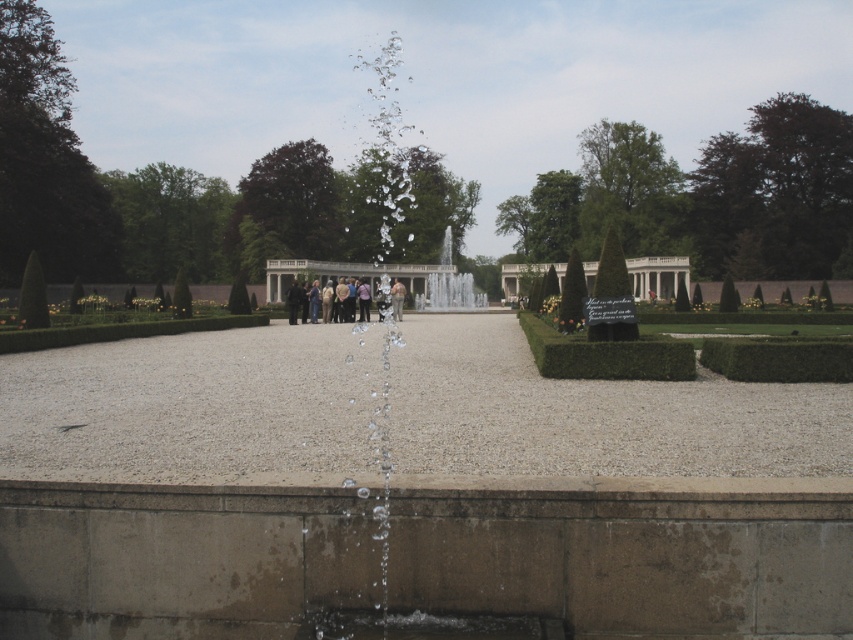
Question: Is gray gravel path at center closer to the viewer compared to green hedge at lower right?

Choices:
 (A) no
 (B) yes

Answer: (B)

Question: Which of the following is the closest to the observer?

Choices:
 (A) clear glass water at center
 (B) gray gravel path at center

Answer: (B)

Question: Where is gray gravel path at center located in relation to matte black people at center in the image?

Choices:
 (A) below
 (B) above

Answer: (A)

Question: Among these objects, which one is nearest to the camera?

Choices:
 (A) white stone palace at center
 (B) green hedge at lower right

Answer: (B)

Question: Is gray gravel path at center positioned at the back of clear glass water at center?

Choices:
 (A) yes
 (B) no

Answer: (B)

Question: Considering the real-world distances, which object is closest to the gray gravel path at center?

Choices:
 (A) white stone palace at center
 (B) matte black people at center
 (C) green hedge at lower right
 (D) clear glass water at center

Answer: (C)